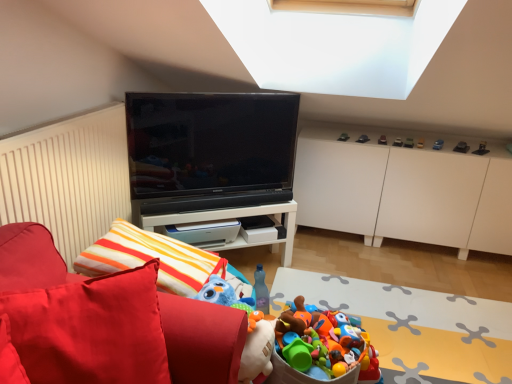
The width and height of the screenshot is (512, 384). Identify the location of vacant space behind metallic gray toy car at upper right, the 10th toy positioned from the left. (443, 137).